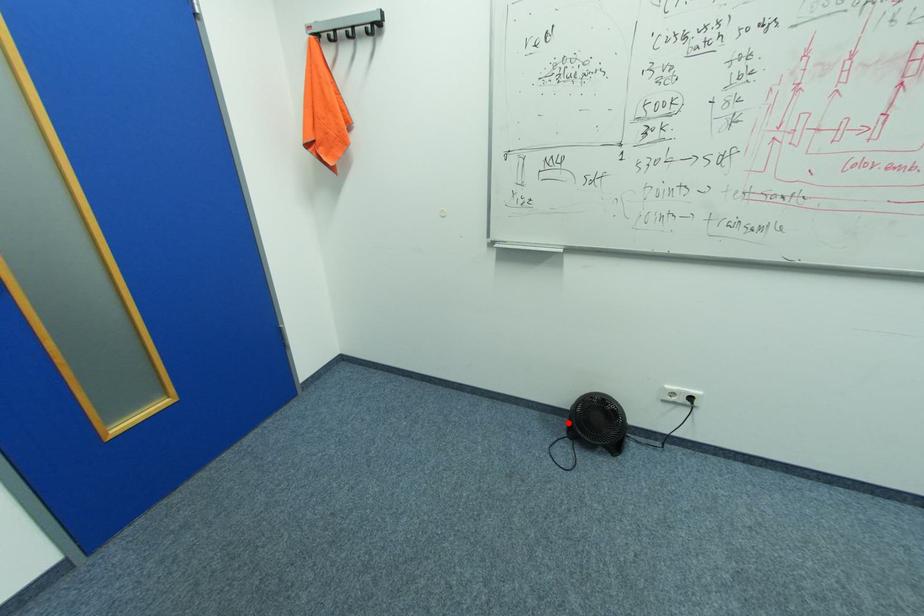
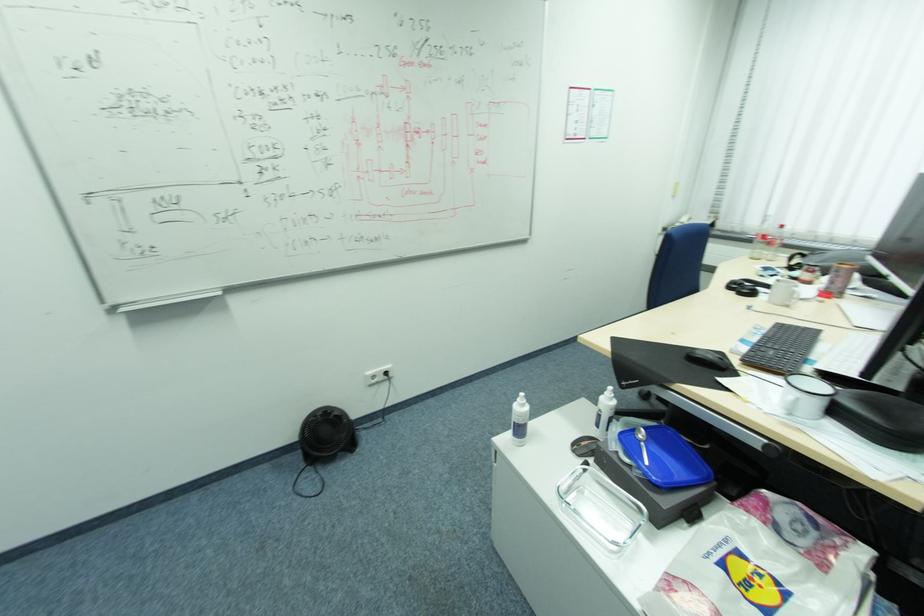
Question: I am providing you with two images of the same scene from different viewpoints. A red point is shown in image1. For the corresponding object point in image2, is it positioned nearer or farther from the camera?

Choices:
 (A) Nearer
 (B) Farther

Answer: (B)